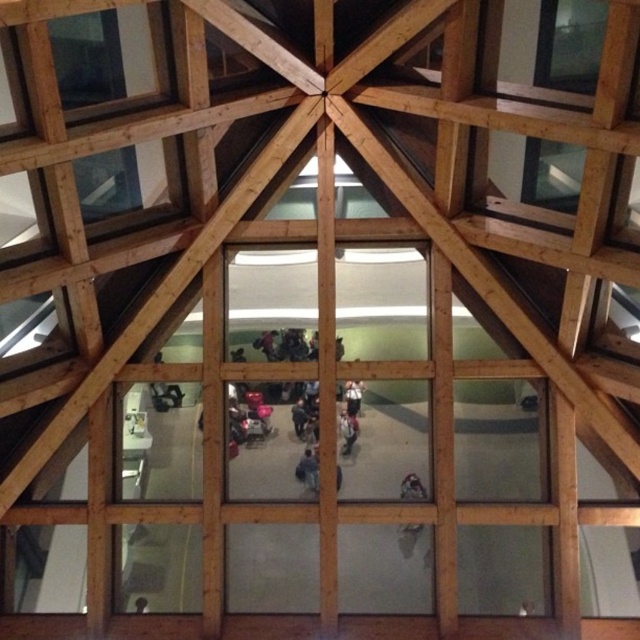
You are standing in the room looking through the window with the geometric wooden frame. There is a dark gray fabric jacket at center. Where is the dark gray fabric jacket located in relation to the window?

The dark gray fabric jacket at center is located at the center of the window view, at coordinates approximately 0.652 on the x axis and 0.473 on the y axis.